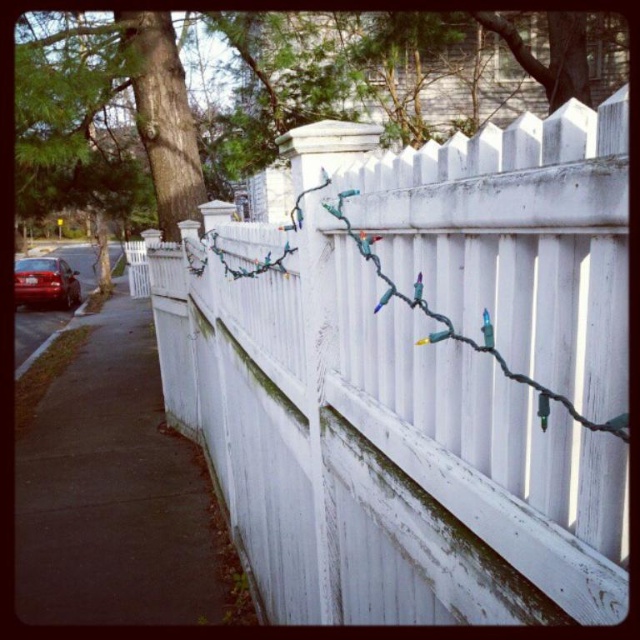
Question: Can you confirm if white painted wood fence at center is smaller than matte black car at left?

Choices:
 (A) yes
 (B) no

Answer: (A)

Question: Among these points, which one is nearest to the camera?

Choices:
 (A) (496, 536)
 (B) (45, 298)

Answer: (A)

Question: Is the position of white painted wood fence at center less distant than that of matte black car at left?

Choices:
 (A) yes
 (B) no

Answer: (A)

Question: Which point is farther to the camera?

Choices:
 (A) matte black car at left
 (B) white painted wood fence at center

Answer: (A)

Question: Can you confirm if white painted wood fence at center is positioned below matte black car at left?

Choices:
 (A) no
 (B) yes

Answer: (B)